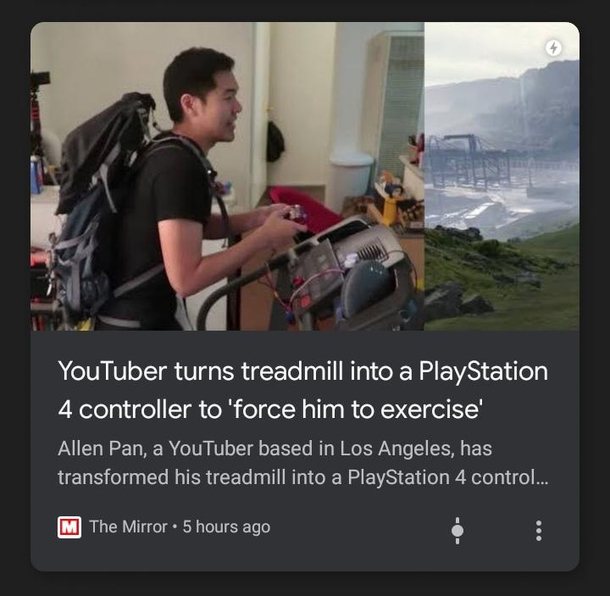
The height and width of the screenshot is (596, 610). What are the coordinates of `picture` in the screenshot? It's located at (155, 296).